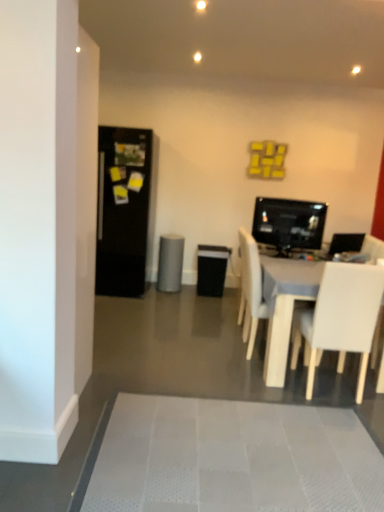
Question: From the image's perspective, is gray matte speaker at center located above or below black matte refrigerator at left?

Choices:
 (A) below
 (B) above

Answer: (A)

Question: Is point (162, 259) closer or farther from the camera than point (135, 248)?

Choices:
 (A) farther
 (B) closer

Answer: (A)

Question: Considering the real-world distances, which object is farthest from the white matte chair at center, the first chair when ordered from back to front?

Choices:
 (A) gray matte speaker at center
 (B) white matte chair at lower right, marked as the first chair in a front-to-back arrangement
 (C) white textured bath mat at lower center
 (D) black matte refrigerator at left
 (E) matte black monitor at center right

Answer: (D)

Question: Estimate the real-world distances between objects in this image. Which object is farther from the matte black monitor at center right?

Choices:
 (A) white matte chair at center, the second chair viewed from the front
 (B) black matte refrigerator at left
 (C) gray matte speaker at center
 (D) white plastic entertainment center at lower right
 (E) white matte chair at lower right, acting as the 2th chair starting from the back

Answer: (B)